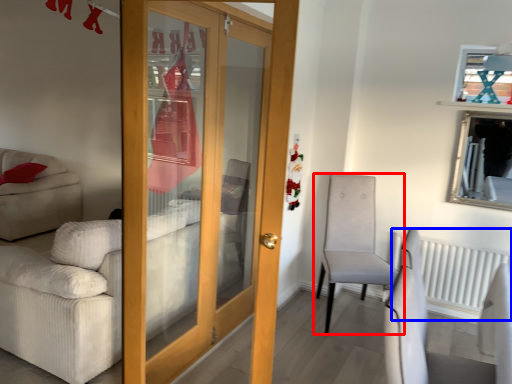
Question: Which point is further to the camera, chair (highlighted by a red box) or radiator (highlighted by a blue box)?

Choices:
 (A) chair
 (B) radiator

Answer: (B)